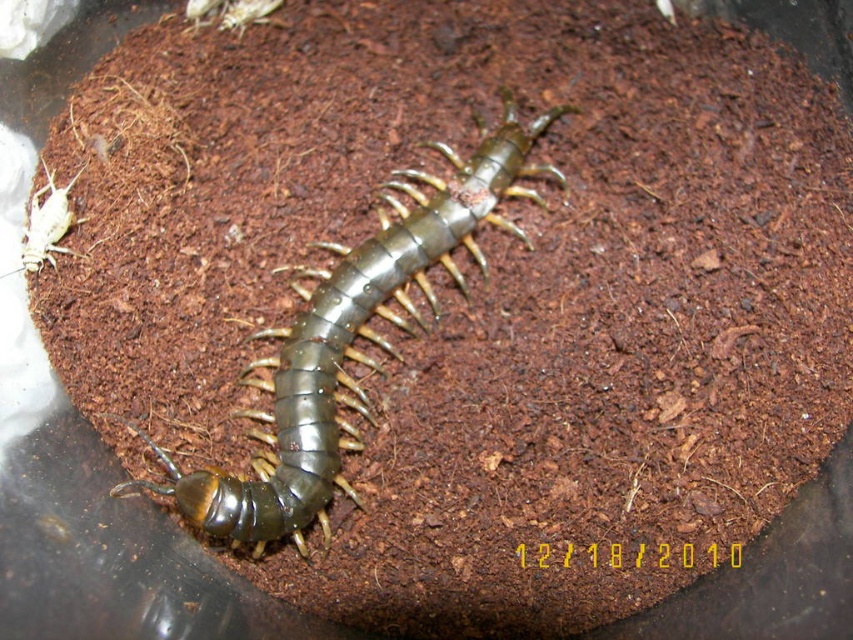
Question: Is shiny metallic centipede at center smaller than white matte cricket at left?

Choices:
 (A) no
 (B) yes

Answer: (A)

Question: Does shiny metallic centipede at center have a smaller size compared to white matte cricket at left?

Choices:
 (A) no
 (B) yes

Answer: (A)

Question: Is shiny metallic centipede at center smaller than white matte cricket at left?

Choices:
 (A) no
 (B) yes

Answer: (A)